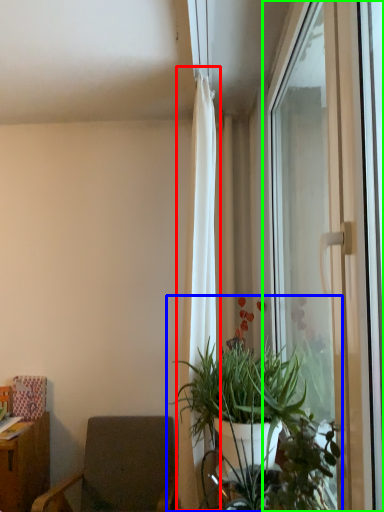
Question: Which is nearer to the curtain (highlighted by a red box)? houseplant (highlighted by a blue box) or window (highlighted by a green box).

Choices:
 (A) houseplant
 (B) window

Answer: (A)